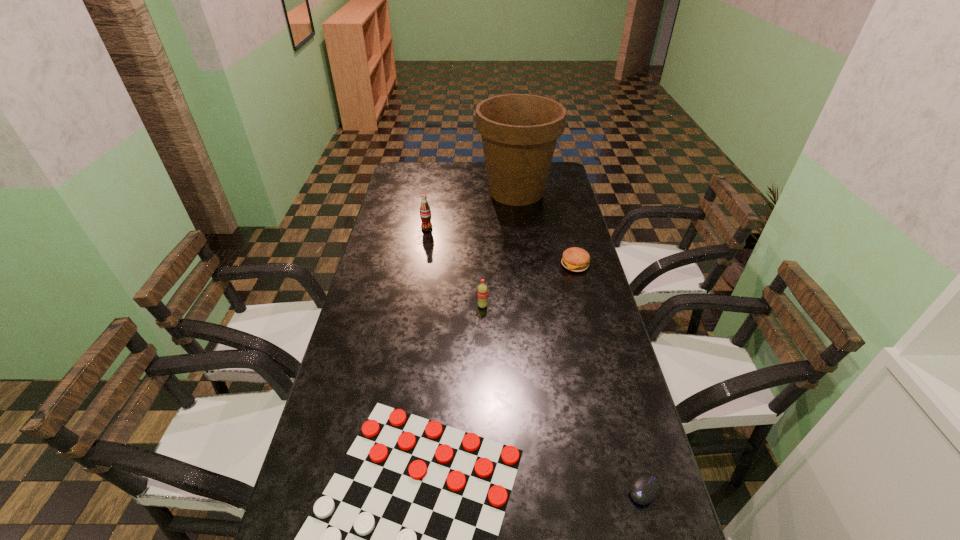
The image size is (960, 540). Identify the location of the tallest object. (519, 132).

At what (x,y) coordinates should I click in order to perform the action: click on flowerpot. Please return your answer as a coordinate pair (x, y). This screenshot has width=960, height=540. Looking at the image, I should click on (x=519, y=132).

Find the location of `the farther soda`. the farther soda is located at coordinates (425, 212).

The image size is (960, 540). I want to click on the fifth shortest object, so click(425, 212).

Where is `the right soda`? the right soda is located at coordinates click(482, 291).

You are a GUI agent. You are given a task and a screenshot of the screen. Output one action in this format:
    pyautogui.click(x=<x>, y=<y>)
    Task: Click on the fourth shortest object
    
    Given the screenshot: What is the action you would take?
    pyautogui.click(x=482, y=291)

Locate an element on the screen. This screenshot has height=540, width=960. the third farthest object is located at coordinates (575, 259).

Where is `hamburger`? hamburger is located at coordinates (575, 259).

Locate an element on the screen. The width and height of the screenshot is (960, 540). the fifth tallest object is located at coordinates (645, 487).

What are the coordinates of `blank space located on the back of the flowerpot` in the screenshot? It's located at (513, 166).